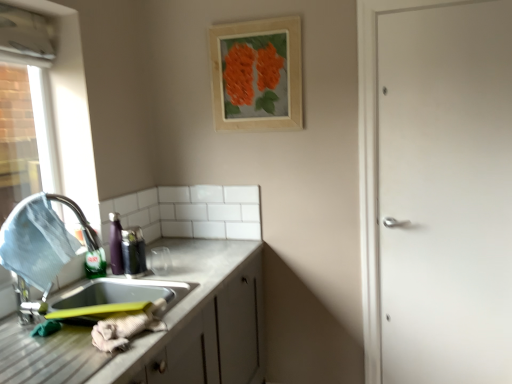
Question: Relative to wooden frame at upper center, is metallic stainless steel sink at lower left in front or behind?

Choices:
 (A) front
 (B) behind

Answer: (A)

Question: Is point (37, 367) positioned closer to the camera than point (220, 112)?

Choices:
 (A) farther
 (B) closer

Answer: (B)

Question: Which is farther from the white matte door at right?

Choices:
 (A) metallic stainless steel sink at lower left
 (B) wooden frame at upper center
 (C) metallic stainless steel sink at left

Answer: (C)

Question: Which object is the farthest from the wooden frame at upper center?

Choices:
 (A) metallic stainless steel sink at lower left
 (B) white matte door at right
 (C) metallic stainless steel sink at left

Answer: (C)